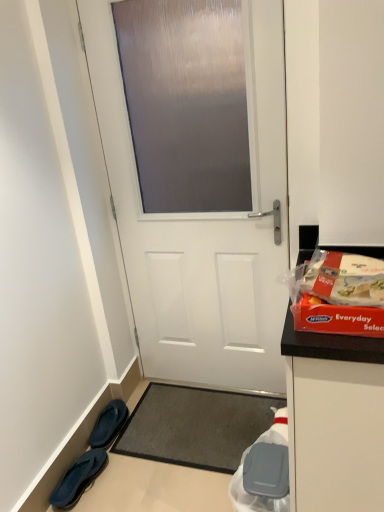
Question: Is white plastic bag at lower right, which is the 1th waste from bottom to top, taller or shorter than red plastic box at right, acting as the 1th waste starting from the front?

Choices:
 (A) tall
 (B) short

Answer: (A)

Question: From a real-world perspective, is white plastic bag at lower right, the 1th waste from the back, above or below red plastic box at right, arranged as the second waste when viewed from the back?

Choices:
 (A) above
 (B) below

Answer: (B)

Question: Based on their relative distances, which object is nearer to the dark gray textured mat at center?

Choices:
 (A) red plastic box at right, arranged as the second waste when viewed from the back
 (B) blue fabric slippers at lower left, the 2th footwear viewed from the back
 (C) white plastic bag at lower right, the 1th waste from the back
 (D) white matte door at center
 (E) black fabric slippers at lower left, acting as the 1th footwear starting from the back

Answer: (E)

Question: Considering the real-world distances, which object is closest to the white plastic bag at lower right, positioned as the 2th waste in top-to-bottom order?

Choices:
 (A) white matte door at center
 (B) blue fabric slippers at lower left, the 2th footwear viewed from the back
 (C) dark gray textured mat at center
 (D) black fabric slippers at lower left, acting as the 1th footwear starting from the back
 (E) red plastic box at right, arranged as the 1th waste when viewed from the top

Answer: (C)